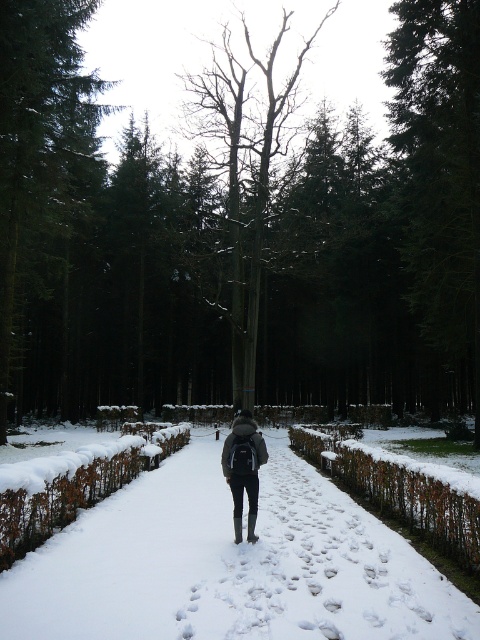
Does white snow at center have a greater width compared to dark gray fabric backpack at center?

Yes, white snow at center is wider than dark gray fabric backpack at center.

In the scene shown: Does white snow at center have a lesser width compared to dark gray fabric backpack at center?

Incorrect, white snow at center's width is not less than dark gray fabric backpack at center's.

Does point (219, 593) come in front of point (239, 540)?

Yes.

Identify the location of white snow at center. The width and height of the screenshot is (480, 640). (229, 564).

Is white snow at center smaller than green textured tree at upper center?

Yes.

Who is more forward, (140, 561) or (37, 97)?

Point (140, 561) is in front.

I want to click on white snow at center, so click(x=229, y=564).

Does bare wood tree at center appear over dark gray fabric backpack at center?

Correct, bare wood tree at center is located above dark gray fabric backpack at center.

Who is positioned more to the left, bare wood tree at center or dark gray fabric backpack at center?

bare wood tree at center is more to the left.

Is point (233, 333) in front of point (245, 464)?

No, (233, 333) is behind (245, 464).

At what (x,y) coordinates should I click in order to perform the action: click on bare wood tree at center. Please return your answer as a coordinate pair (x, y). The width and height of the screenshot is (480, 640). Looking at the image, I should click on (256, 209).